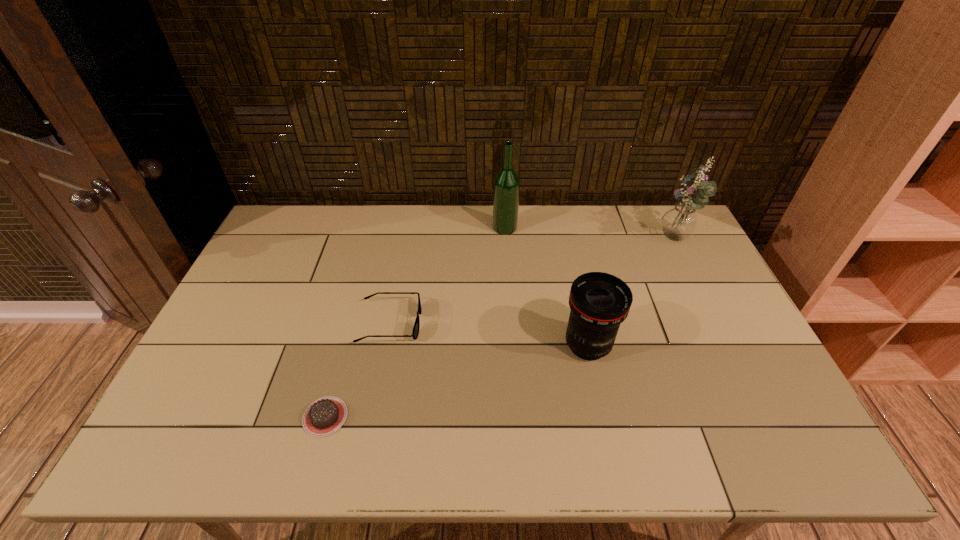
Where is `the third object from right to left`? The image size is (960, 540). the third object from right to left is located at coordinates (506, 189).

Locate an element on the screen. This screenshot has width=960, height=540. bouquet is located at coordinates (679, 222).

Where is `the fourth object from left to right`? The height and width of the screenshot is (540, 960). the fourth object from left to right is located at coordinates (599, 302).

Where is `the third tallest object`? This screenshot has height=540, width=960. the third tallest object is located at coordinates (599, 302).

Locate an element on the screen. Image resolution: width=960 pixels, height=540 pixels. spectacles is located at coordinates (415, 332).

Where is `the shortest object`? The width and height of the screenshot is (960, 540). the shortest object is located at coordinates (326, 415).

Locate an element on the screen. This screenshot has width=960, height=540. the nearest object is located at coordinates (326, 415).

The height and width of the screenshot is (540, 960). In order to click on free space located on the right of the alcohol in this screenshot , I will do `click(584, 227)`.

The height and width of the screenshot is (540, 960). I want to click on free spot located on the front-facing side of the bouquet, so click(x=575, y=242).

Identify the location of free space located 0.390m on the front-facing side of the bouquet. The image size is (960, 540). (543, 242).